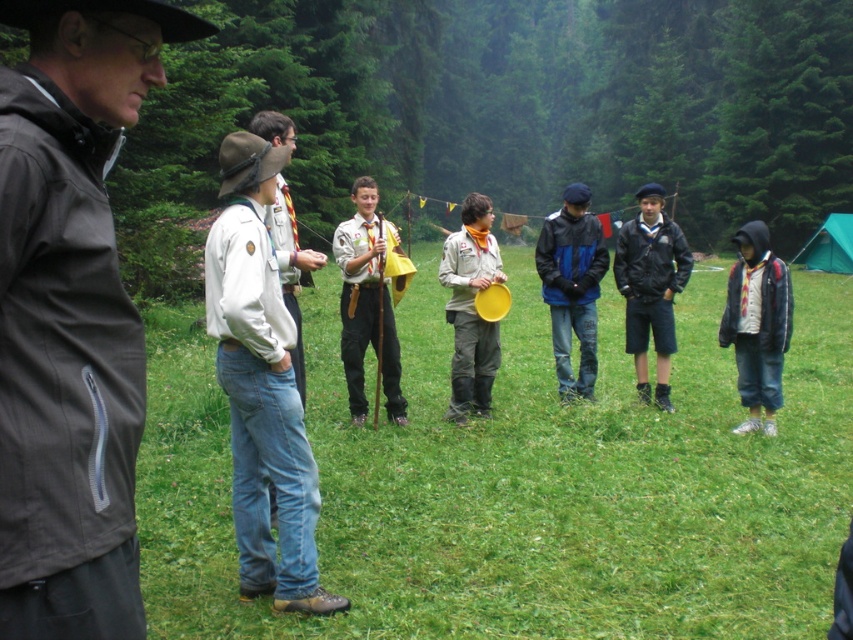
The scene shows a campsite with a group of scouts. There is a point marked at coordinates (520,481). What is located at this point?

The point at coordinates (520,481) marks green grass at center.

You are a photographer trying to capture the entire group of scouts in your photo. You notice two points marked in the scene at coordinates point (x=91, y=593) and point (x=262, y=301). Which point should you focus on to ensure the scouts are in sharp focus if you want to include both points in your frame?

You should focus on point (x=91, y=593) because it is closer to the camera than point (x=262, y=301), so focusing on the closer point will ensure both are in focus.

You are a scout member standing at the edge of the campsite. You see the matte yellow frisbee at center. Can you reach it without leaving the campsite area?

The matte yellow frisbee at center is 7.44 meters from viewer, so yes, you can reach it without leaving the campsite area as it is within the campsite.